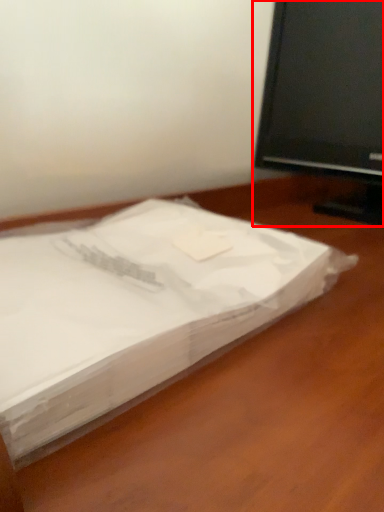
Question: Where is television (annotated by the red box) located in relation to desk in the image?

Choices:
 (A) left
 (B) right

Answer: (B)